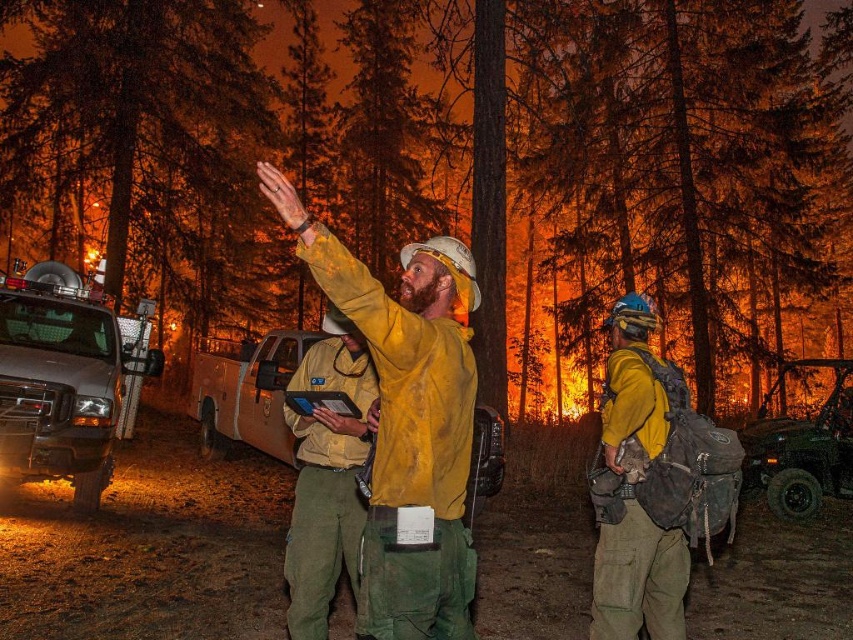
Question: Which object appears farthest from the camera in this image?

Choices:
 (A) yellow matte jacket at right
 (B) brushed metal truck at left
 (C) yellow fire-resistant suit at center
 (D) yellow fire-resistant jacket at center

Answer: (B)

Question: Does matte yellow truck at center have a greater width compared to brushed metal jeep at lower right?

Choices:
 (A) yes
 (B) no

Answer: (A)

Question: Observing the image, what is the correct spatial positioning of brushed metal truck at left in reference to matte yellow truck at center?

Choices:
 (A) left
 (B) right

Answer: (A)

Question: Observing the image, what is the correct spatial positioning of brushed metal truck at left in reference to yellow matte jacket at right?

Choices:
 (A) below
 (B) above

Answer: (B)

Question: Which point is farther to the camera?

Choices:
 (A) (762, 426)
 (B) (88, 502)
 (C) (399, 433)
 (D) (314, 516)

Answer: (A)

Question: Which point appears closest to the camera in this image?

Choices:
 (A) (86, 339)
 (B) (424, 424)
 (C) (657, 586)
 (D) (312, 508)

Answer: (B)